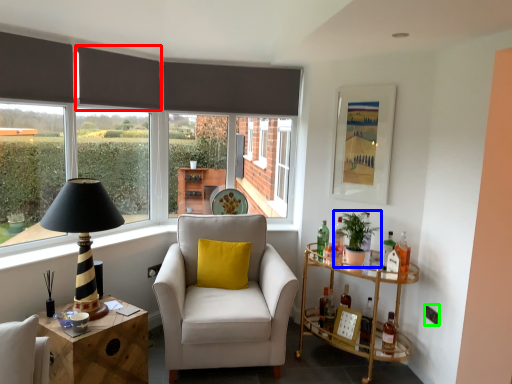
Question: Based on their relative distances, which object is nearer to curtain (highlighted by a red box)? Choose from houseplant (highlighted by a blue box) and power outlet (highlighted by a green box).

Choices:
 (A) houseplant
 (B) power outlet

Answer: (A)